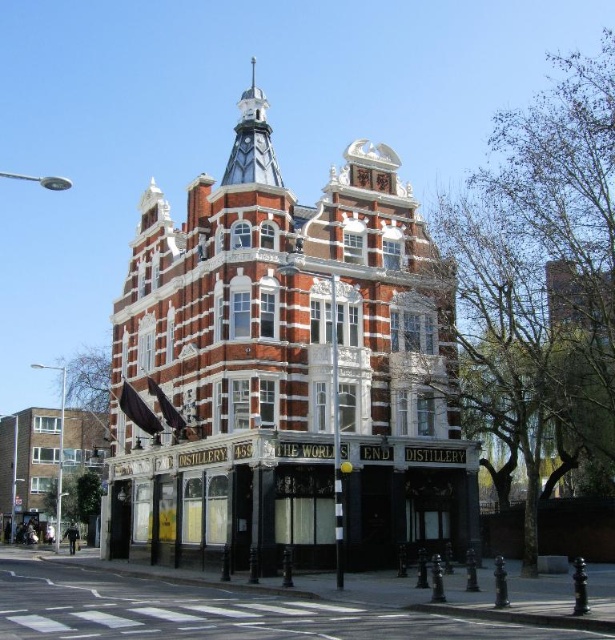
The height and width of the screenshot is (640, 615). Describe the element at coordinates (287, 371) in the screenshot. I see `red brick building at center` at that location.

Looking at this image, measure the distance between red brick building at center and camera.

A distance of 50.26 meters exists between red brick building at center and camera.

I want to click on red brick building at center, so click(x=287, y=371).